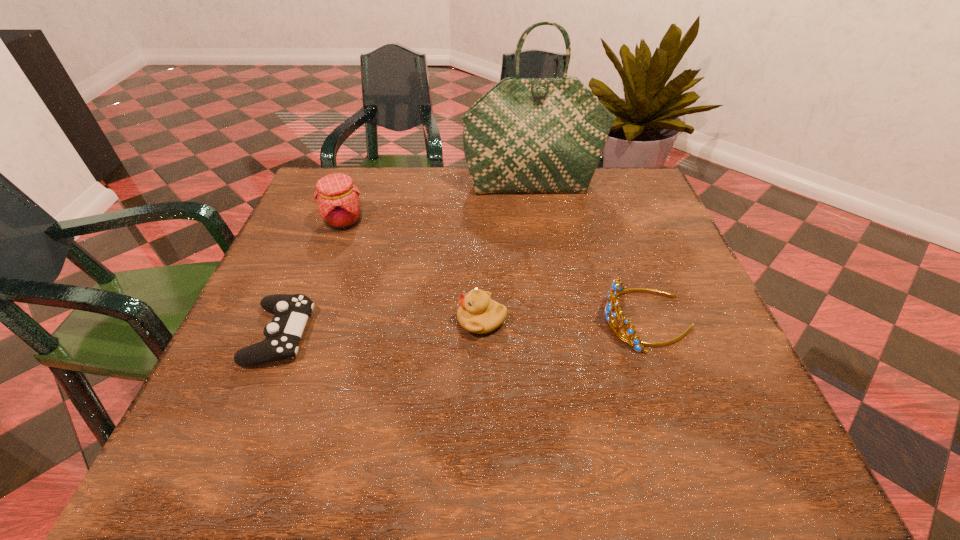
You are a GUI agent. You are given a task and a screenshot of the screen. Output one action in this format:
    pyautogui.click(x=<x>, y=<y>)
    Task: Click on the vacant region between the fourth tallest object and the farthest object
    
    Given the screenshot: What is the action you would take?
    pyautogui.click(x=507, y=253)

The image size is (960, 540). What are the coordinates of `vacant space in between the tiara and the duckling` in the screenshot? It's located at (564, 320).

I want to click on vacant point located between the tiara and the second farthest object, so click(x=495, y=271).

What are the coordinates of `free area in between the second shortest object and the jam` in the screenshot? It's located at (413, 271).

Where is `free space between the tiara and the farthest object`? The width and height of the screenshot is (960, 540). free space between the tiara and the farthest object is located at coordinates (589, 253).

Where is `vacant area that lies between the duckling and the tiara`? vacant area that lies between the duckling and the tiara is located at coordinates pyautogui.click(x=564, y=320).

I want to click on free space between the tiara and the farthest object, so click(x=589, y=253).

Image resolution: width=960 pixels, height=540 pixels. In order to click on vacant point located between the fourth nearest object and the farthest object in this screenshot , I will do `click(439, 204)`.

You are a GUI agent. You are given a task and a screenshot of the screen. Output one action in this format:
    pyautogui.click(x=<x>, y=<y>)
    Task: Click on the free space between the fourth nearest object and the tiara
    The height and width of the screenshot is (540, 960).
    Given the screenshot: What is the action you would take?
    pyautogui.click(x=495, y=271)

This screenshot has width=960, height=540. In order to click on object that is the nearest to the tiara in this screenshot , I will do `click(478, 314)`.